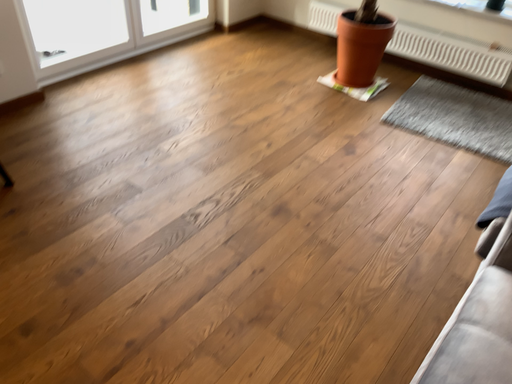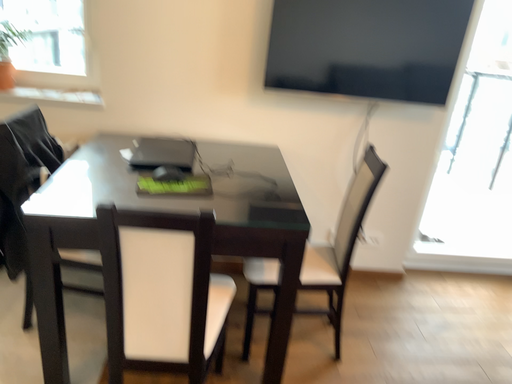
Question: Which way did the camera rotate in the video?

Choices:
 (A) rotated right
 (B) rotated left

Answer: (B)